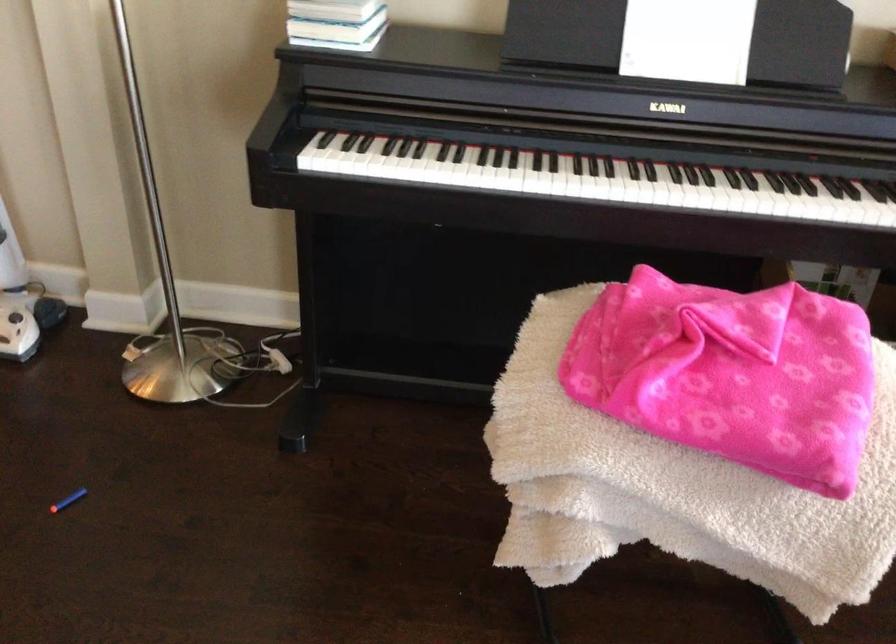
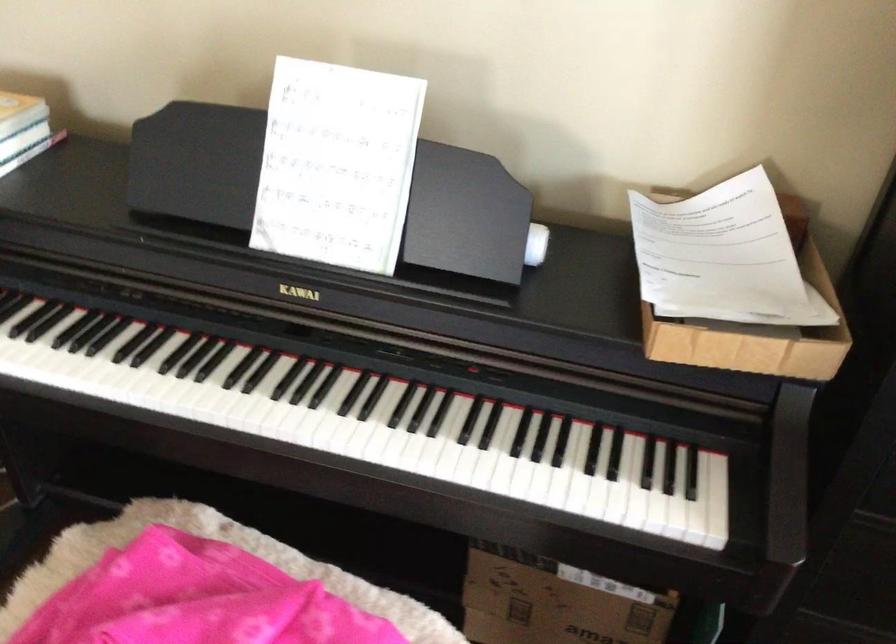
Find the pixel in the second image that matches (x=548, y=174) in the first image.

(116, 382)